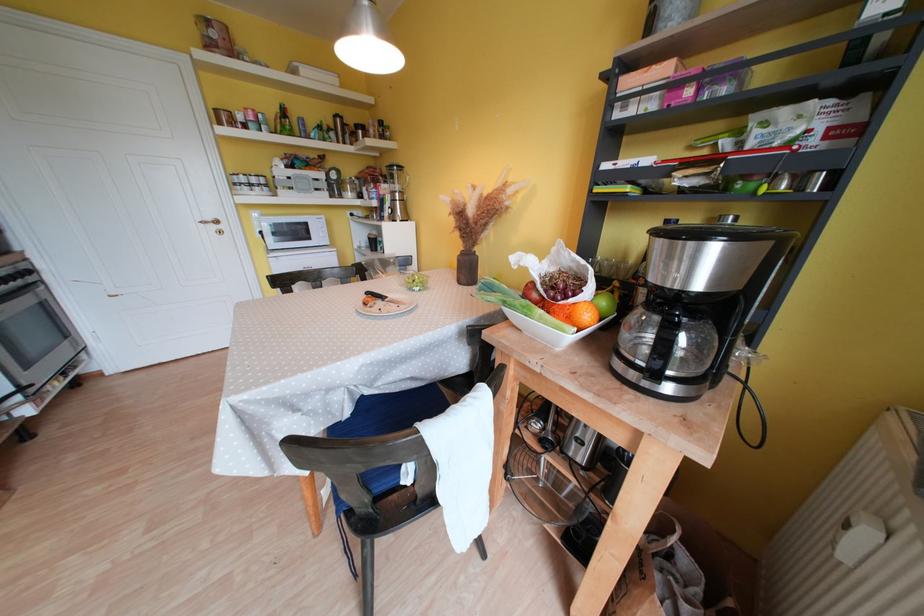
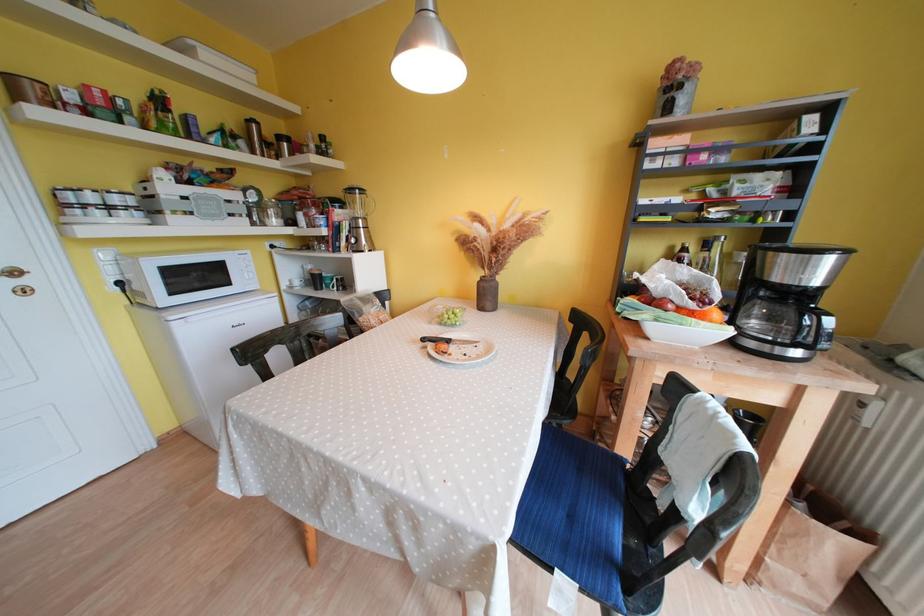
Question: The images are taken continuously from a first-person perspective. In which direction are you moving?

Choices:
 (A) Left
 (B) Right
 (C) Forward
 (D) Backward

Answer: (A)